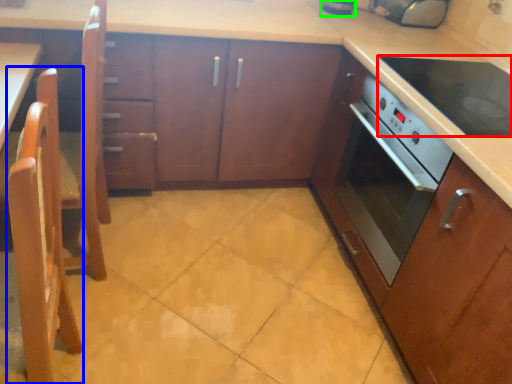
Question: Based on their relative distances, which object is farther from kitchen appliance (highlighted by a red box)? Choose from chair (highlighted by a blue box) and appliance (highlighted by a green box).

Choices:
 (A) chair
 (B) appliance

Answer: (A)